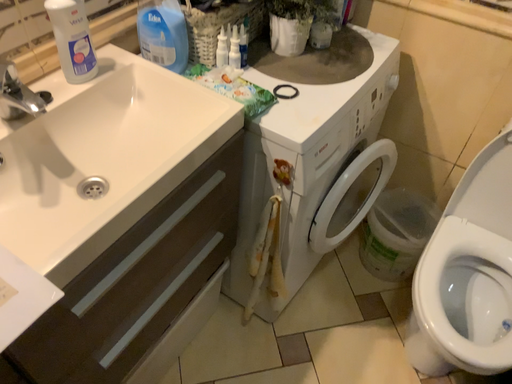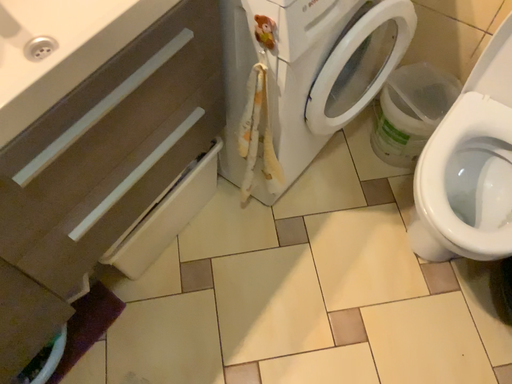
Question: Which way did the camera rotate in the video?

Choices:
 (A) rotated downward
 (B) rotated upward

Answer: (A)